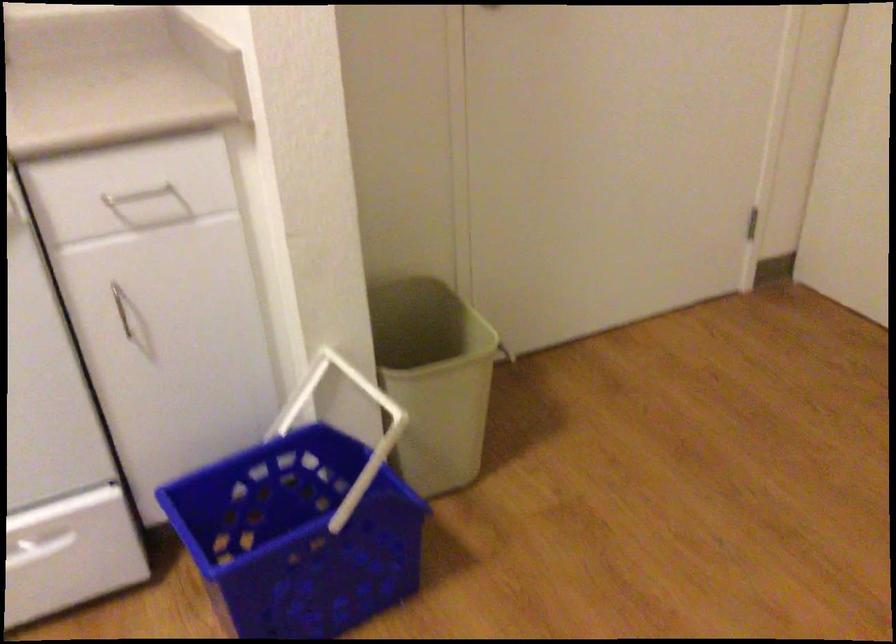
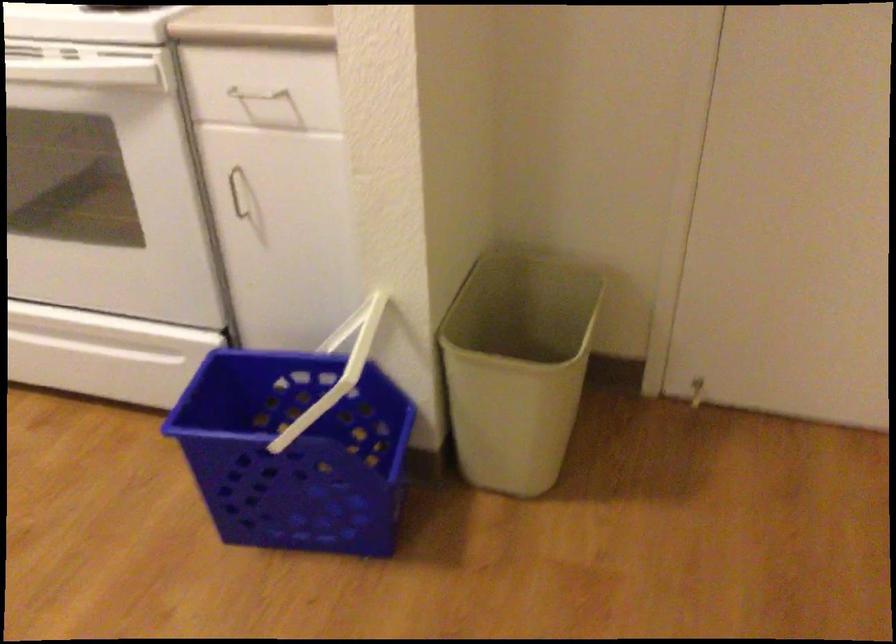
In the second image, find the point that corresponds to (295,400) in the first image.

(346, 328)